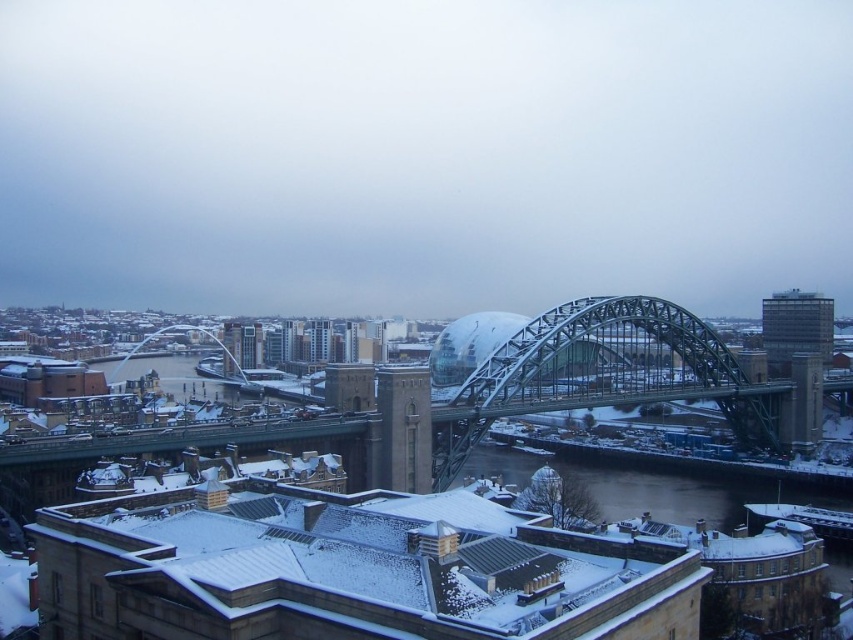
You are an architect analyzing the winter cityscape. You need to determine the exact position of the metallic steel bridge at center in the image. What are its coordinates?

The metallic steel bridge at center is located at coordinates point (601,372).

You are a delivery drone operator. Your drone has a wingspan of 1.2 meters. You need to fly the drone through the space between the metallic steel bridge at center and the glassy reflective building at upper right. Can the drone safely pass through this space without touching either structure?

The metallic steel bridge at center might be wider than the glassy reflective building at upper right. However, the exact width of the space between them is not provided. Without knowing the specific distance, it is uncertain if the drone with a 1.2 meter wingspan can safely pass through. More information about the gap width is needed to determine safety.

Based on the scene described, which object is positioned to the left when comparing the metallic steel bridge at center and the glassy reflective building at upper right?

The metallic steel bridge at center is positioned to the left of the glassy reflective building at upper right.